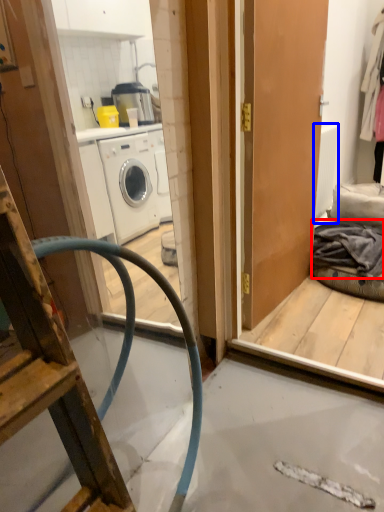
Question: Which object is further to the camera taking this photo, clothing (highlighted by a red box) or radiator (highlighted by a blue box)?

Choices:
 (A) clothing
 (B) radiator

Answer: (B)